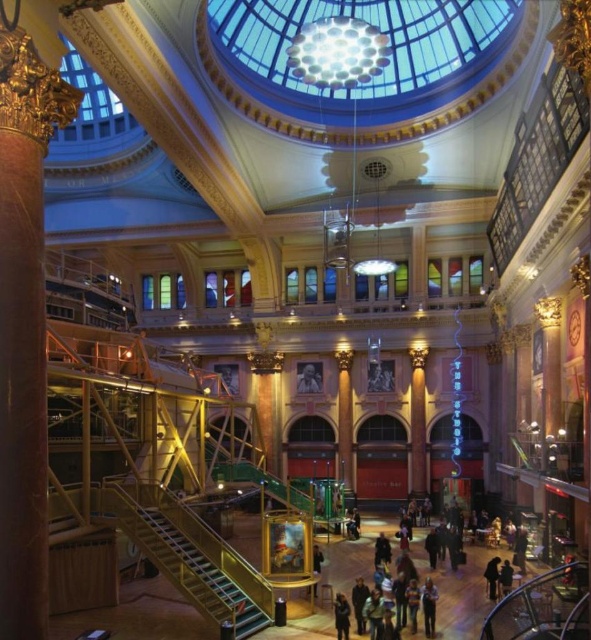
You are standing in the grand building and notice two items at the lower center of the scene. The blue denim jeans at lower center and the dark blue jacket at lower center. Which item is positioned higher in relation to the other?

The blue denim jeans at lower center is located above the dark blue jacket at lower center.

You are standing at the entrance of the grand building and want to reach the metallic staircase at lower center. Is the gold ornate column at left blocking your path? Explain why or why not.

The gold ornate column at left is in front of the metallic staircase at lower center, so it is blocking the path to the staircase. To reach the staircase, you would need to go around the column.